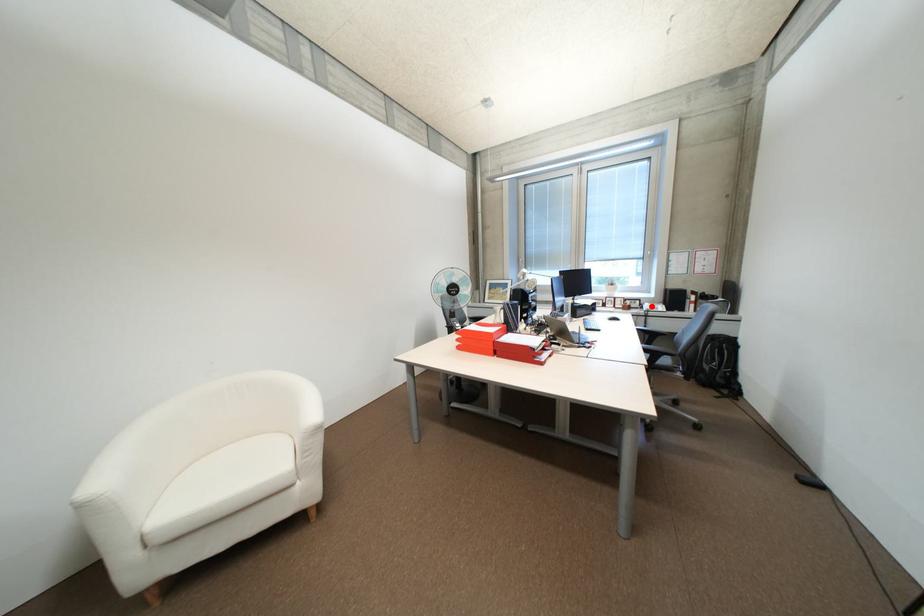
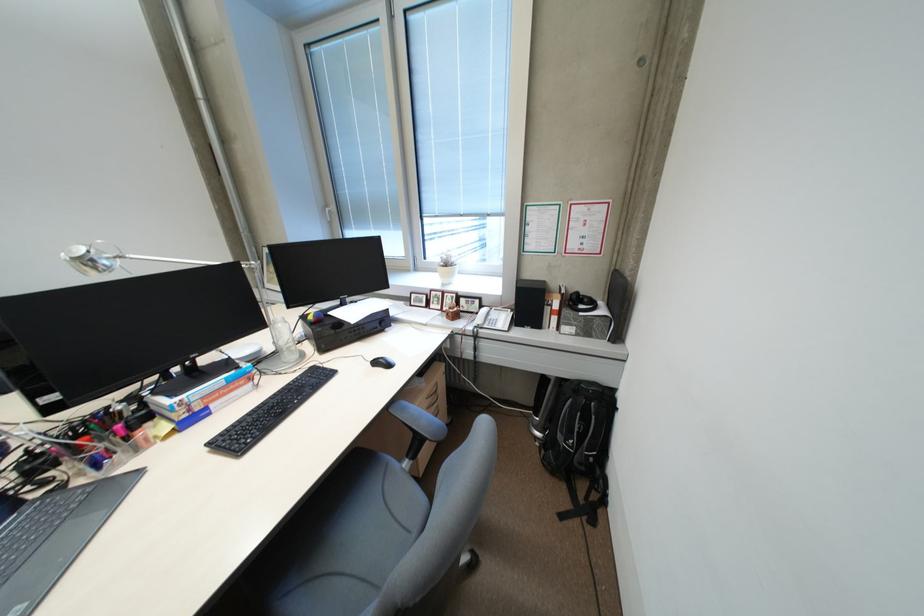
Find the pixel in the second image that matches the highlighted location in the first image.

(487, 314)